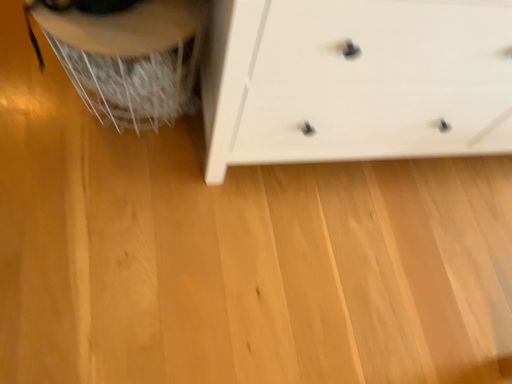
This screenshot has width=512, height=384. Find the location of `spots to the right of white plastic swivel chair at left`. spots to the right of white plastic swivel chair at left is located at coordinates (212, 189).